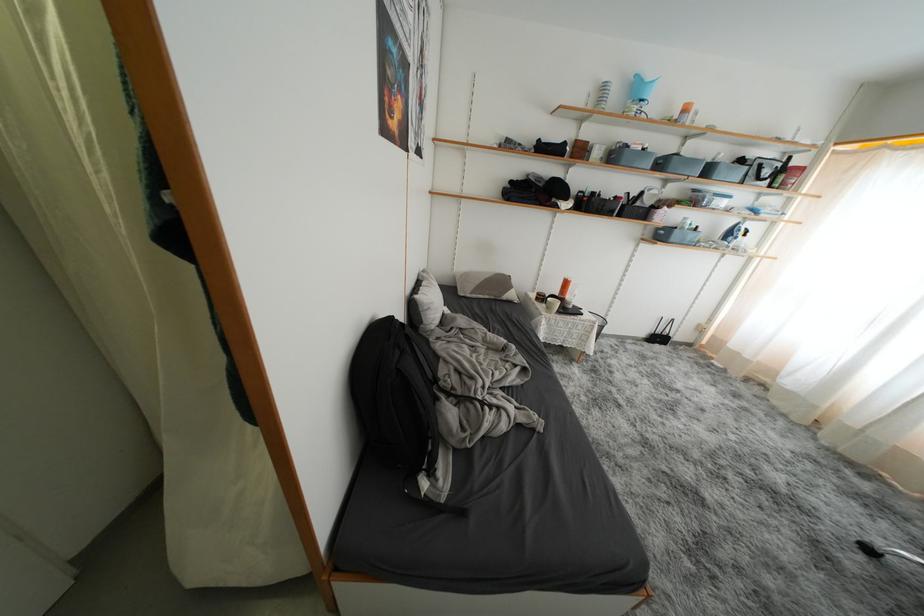
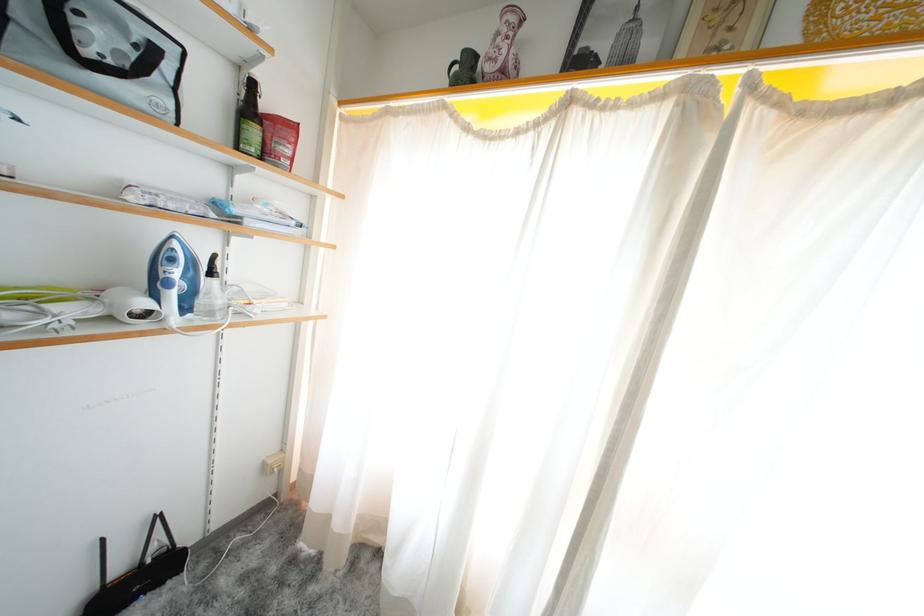
The point at (719, 339) is marked in the first image. Where is the corresponding point in the second image?

(306, 475)